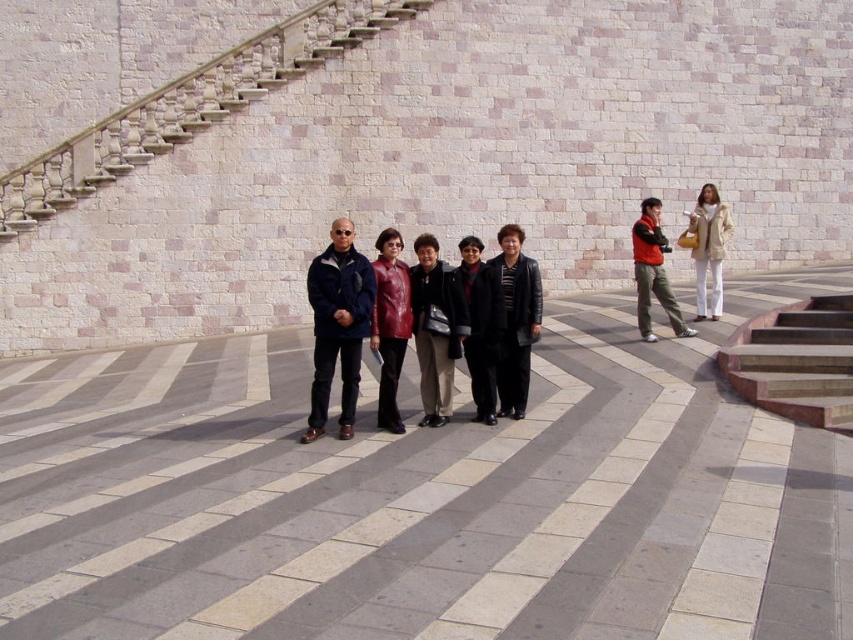
Question: Is wooden steps at right to the right of matte red jacket at center from the viewer's perspective?

Choices:
 (A) yes
 (B) no

Answer: (A)

Question: Does wooden steps at right appear on the left side of matte blue jacket at center?

Choices:
 (A) yes
 (B) no

Answer: (B)

Question: Which object is positioned farthest from the beige leather coat at right?

Choices:
 (A) white stone staircase at upper left
 (B) dark brown leather jacket at center
 (C) matte black jacket at center

Answer: (A)

Question: Which point appears closest to the camera in this image?

Choices:
 (A) (505, 369)
 (B) (798, 328)
 (C) (492, 419)

Answer: (C)

Question: Is matte red jacket at center closer to the viewer compared to beige leather coat at right?

Choices:
 (A) yes
 (B) no

Answer: (A)

Question: Which point appears farthest from the camera in this image?

Choices:
 (A) (653, 232)
 (B) (444, 269)
 (C) (326, 344)
 (D) (722, 348)

Answer: (A)